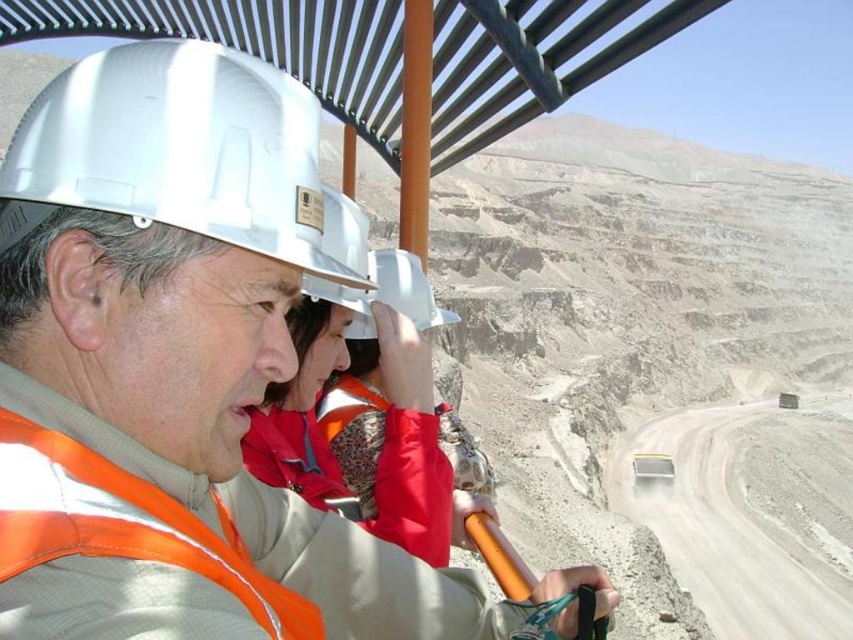
Between orange reflective vest at center and white matte hard hat at upper center, which one appears on the left side from the viewer's perspective?

From the viewer's perspective, white matte hard hat at upper center appears more on the left side.

Is point (44, 381) closer to camera compared to point (280, 252)?

Yes, it is.

The image size is (853, 640). I want to click on orange reflective vest at center, so tap(177, 360).